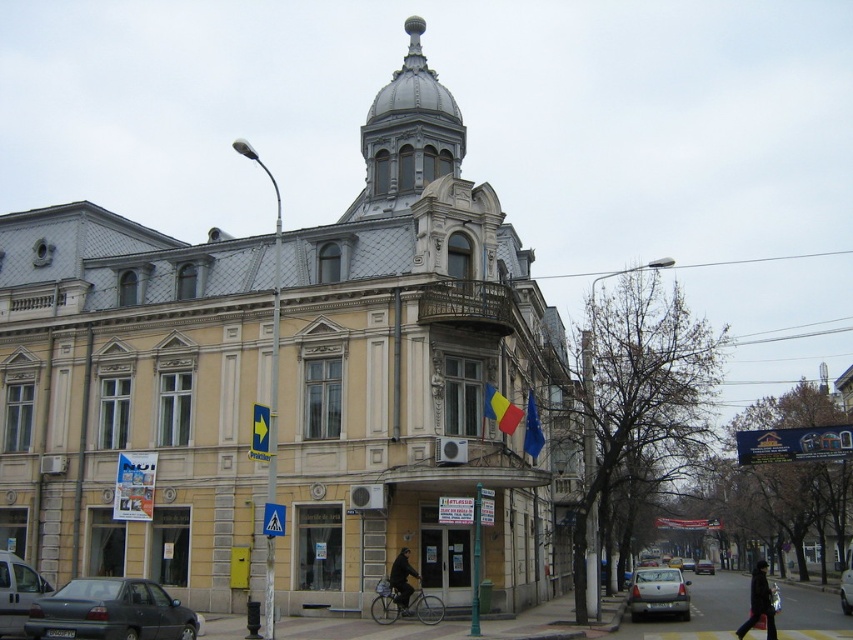
Question: Considering the real-world distances, which object is farthest from the dark gray coat at lower right?

Choices:
 (A) dark blue jacket at center
 (B) yellow fabric flag at center
 (C) silver metallic sedan at center
 (D) blue fabric flag at center

Answer: (C)

Question: Can you confirm if matte gray van at lower left is positioned above blue fabric flag at center?

Choices:
 (A) no
 (B) yes

Answer: (A)

Question: Which object is positioned closest to the dark blue jacket at center?

Choices:
 (A) matte black car at lower left
 (B) dark gray coat at lower right

Answer: (A)

Question: Among these objects, which one is farthest from the camera?

Choices:
 (A) white glossy car at center
 (B) dark blue jacket at center
 (C) yellow fabric flag at center

Answer: (A)

Question: Does dark gray coat at lower right lie in front of yellow fabric flag at center?

Choices:
 (A) yes
 (B) no

Answer: (A)

Question: Can you confirm if matte black car at lower left is positioned to the left of dark blue jacket at center?

Choices:
 (A) yes
 (B) no

Answer: (A)